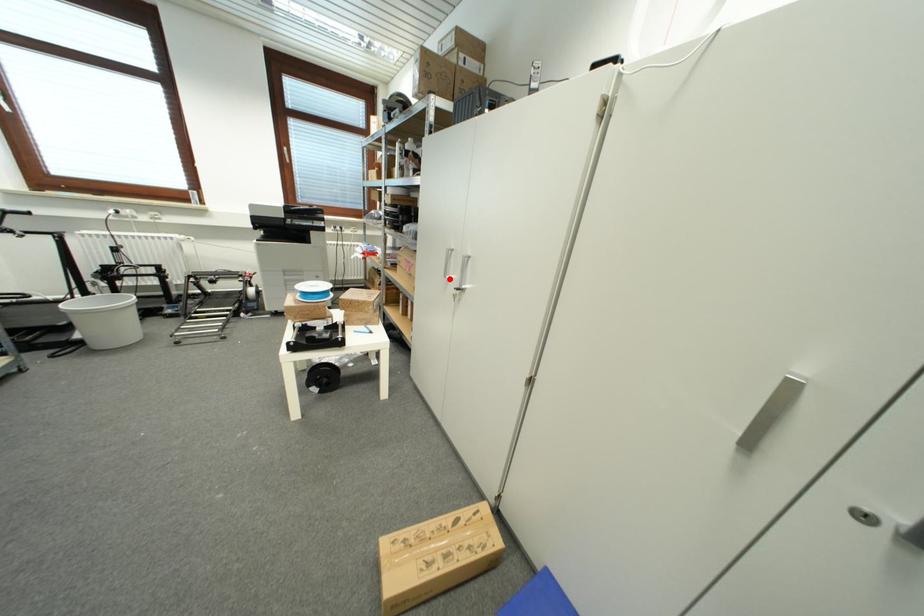
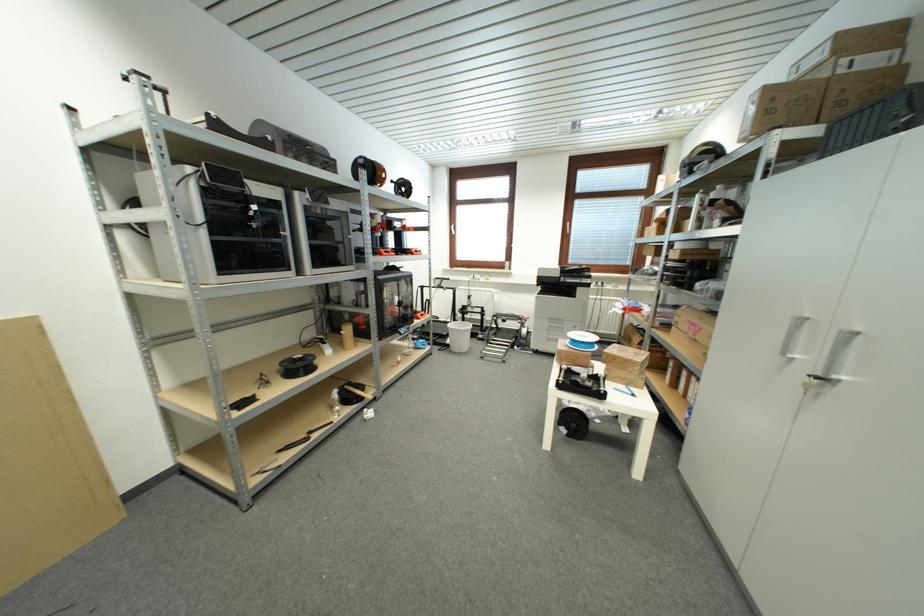
Where in the second image is the point corresponding to the highlighted location from the first image?

(787, 357)